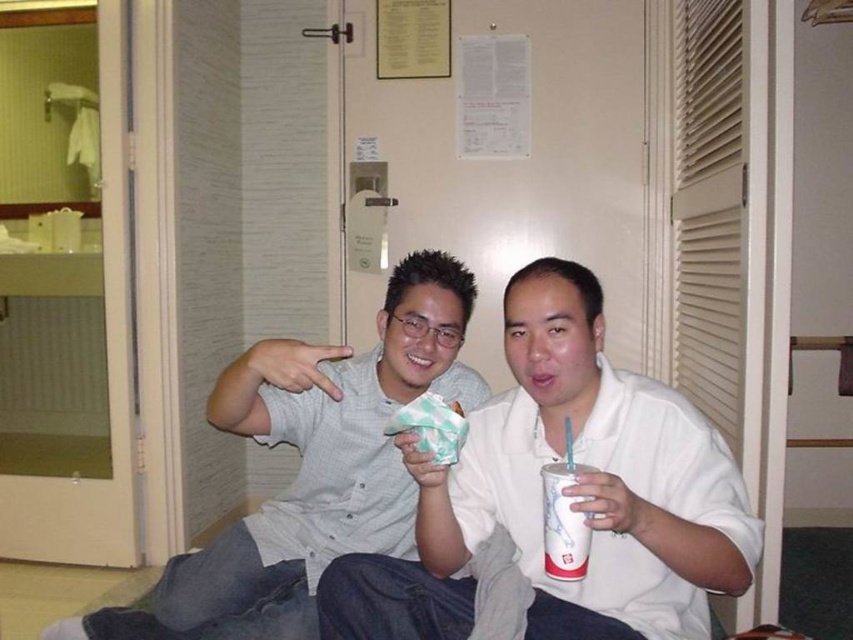
Based on the photo, which of these two, matte gray shirt at center or white paper cup at center, stands shorter?

white paper cup at center

This screenshot has width=853, height=640. What do you see at coordinates (312, 467) in the screenshot? I see `matte gray shirt at center` at bounding box center [312, 467].

Image resolution: width=853 pixels, height=640 pixels. I want to click on matte gray shirt at center, so click(312, 467).

Between point (697, 620) and point (427, 452), which one is positioned in front?

Point (427, 452) is more forward.

Does white matte shirt at center come behind matte paper ice cream cone at center?

No, white matte shirt at center is in front of matte paper ice cream cone at center.

Where is `white matte shirt at center`? This screenshot has width=853, height=640. white matte shirt at center is located at coordinates (566, 493).

Image resolution: width=853 pixels, height=640 pixels. I want to click on white matte shirt at center, so click(566, 493).

Does white paper cup at center lie in front of matte paper ice cream cone at center?

Yes.

Is white paper cup at center shorter than matte paper ice cream cone at center?

No, white paper cup at center is not shorter than matte paper ice cream cone at center.

Is point (561, 490) behind point (450, 461)?

No.

In order to click on white paper cup at center in this screenshot , I will do `click(564, 522)`.